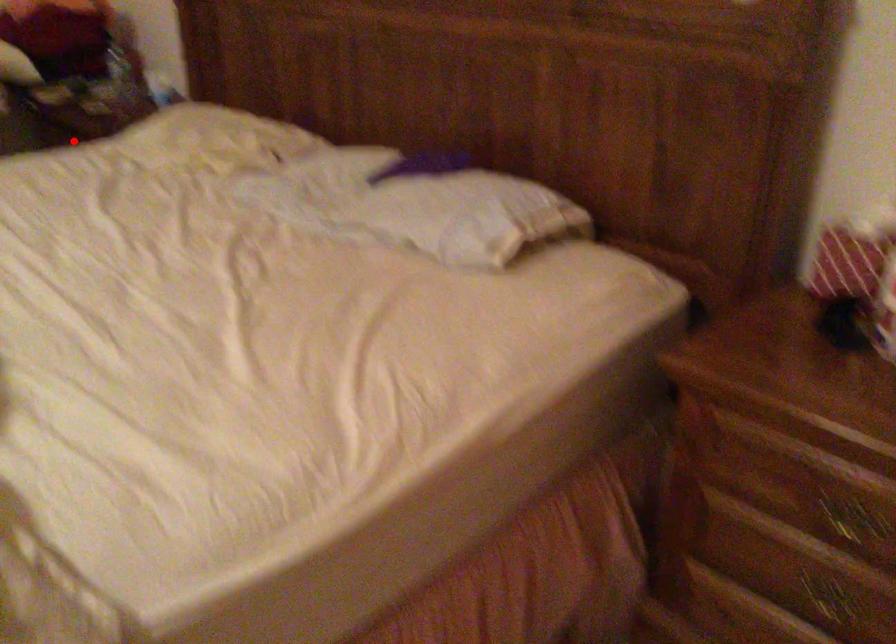
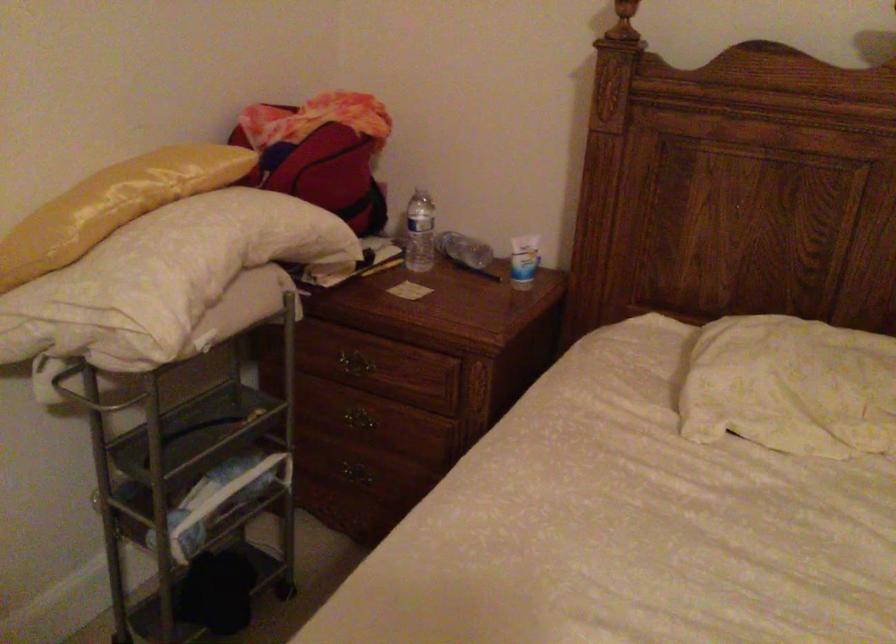
Question: I am providing you with two images of the same scene from different viewpoints. In image1, a red point is highlighted. Considering the same 3D point in image2, which of the following is correct?

Choices:
 (A) It is closer
 (B) It is farther

Answer: (A)